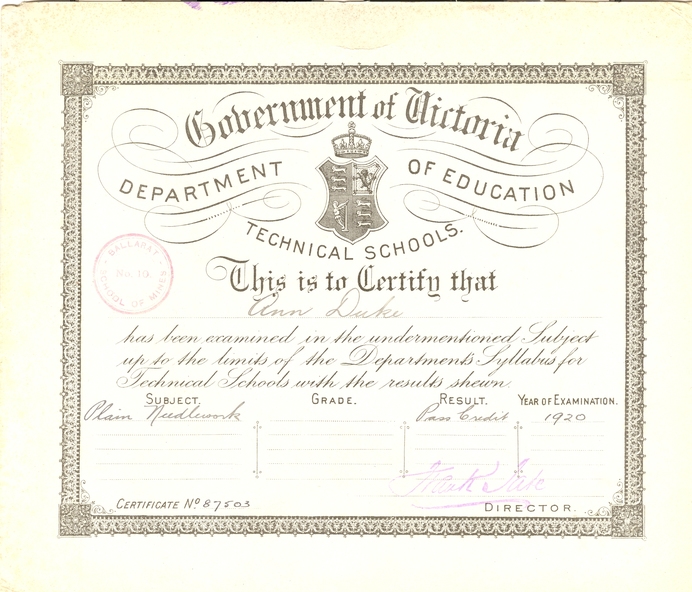
Locate an element on the screen. This screenshot has height=592, width=692. graduation certificate is located at coordinates (196, 285).